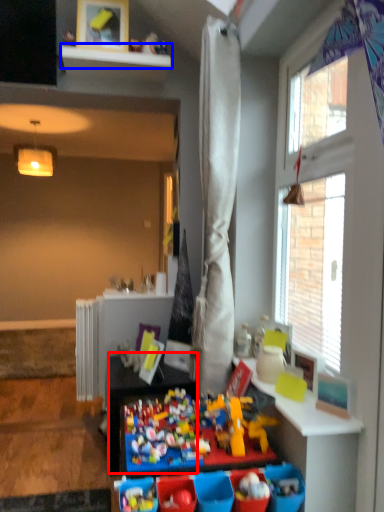
Question: Among these objects, which one is nearest to the camera, table (highlighted by a red box) or shelf (highlighted by a blue box)?

Choices:
 (A) table
 (B) shelf

Answer: (A)